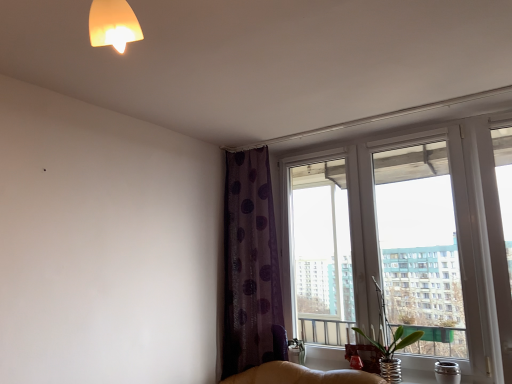
Identify the location of empty space that is ontop of purple dotted fabric at upper center (from a real-world perspective). (250, 145).